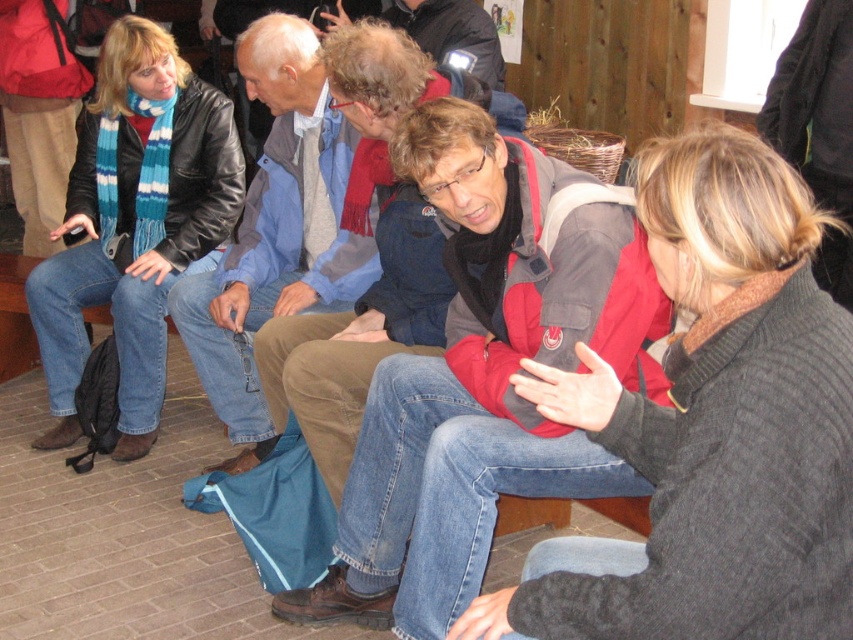
Does matte gray jacket at center have a smaller size compared to blue denim jeans at center?

No.

Does matte gray jacket at center have a larger size compared to blue denim jeans at center?

Yes.

Identify the location of matte gray jacket at center. (483, 372).

Looking at this image, which is below, knitted dark gray sweater at center or blue denim jeans at center?

knitted dark gray sweater at center is lower down.

Can you confirm if knitted dark gray sweater at center is positioned below blue denim jeans at center?

Indeed, knitted dark gray sweater at center is positioned under blue denim jeans at center.

Describe the element at coordinates (717, 420) in the screenshot. The height and width of the screenshot is (640, 853). I see `knitted dark gray sweater at center` at that location.

Identify the location of knitted dark gray sweater at center. pos(717,420).

Describe the element at coordinates (717, 420) in the screenshot. I see `knitted dark gray sweater at center` at that location.

Can you confirm if knitted dark gray sweater at center is thinner than matte black leather jacket at left?

Correct, knitted dark gray sweater at center's width is less than matte black leather jacket at left's.

The height and width of the screenshot is (640, 853). Identify the location of knitted dark gray sweater at center. (717, 420).

This screenshot has width=853, height=640. I want to click on knitted dark gray sweater at center, so click(717, 420).